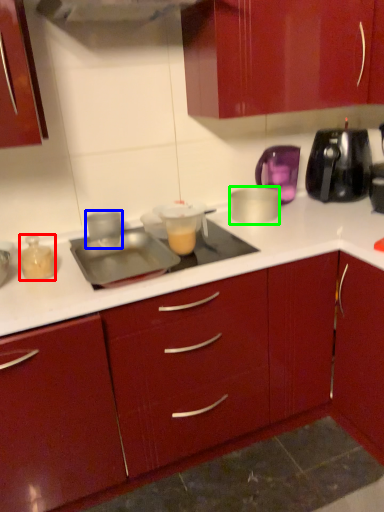
Question: Which object is the closest to the kitchen appliance (highlighted by a red box)? Choose among these: kitchen appliance (highlighted by a blue box) or kitchen appliance (highlighted by a green box).

Choices:
 (A) kitchen appliance
 (B) kitchen appliance

Answer: (A)